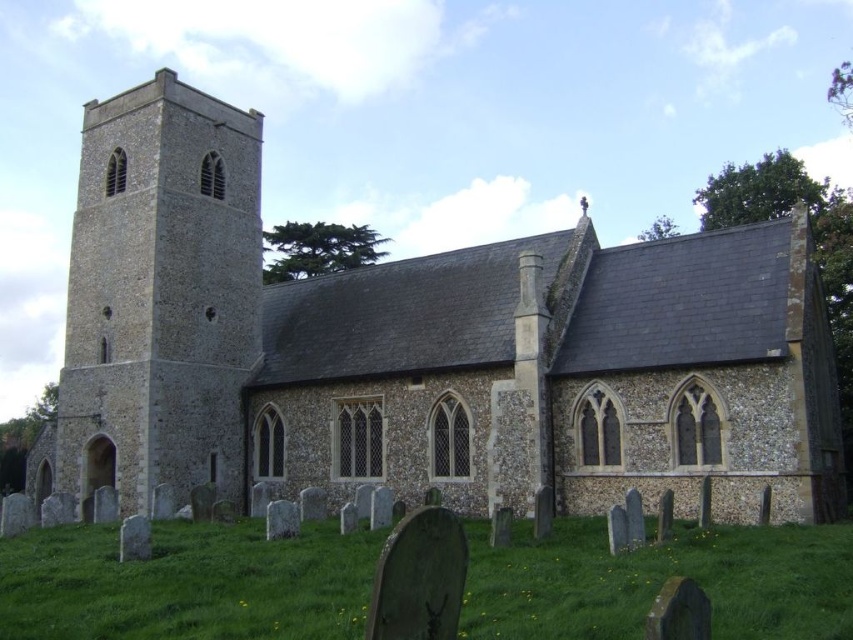
Question: Which object is closer to the camera taking this photo?

Choices:
 (A) stone tower at left
 (B) green grass at lower center
 (C) stone church at center

Answer: (B)

Question: Which point is closer to the camera?

Choices:
 (A) stone tower at left
 (B) stone church at center

Answer: (B)

Question: Can you confirm if stone church at center is positioned above stone tower at left?

Choices:
 (A) yes
 (B) no

Answer: (B)

Question: Does stone church at center have a larger size compared to green grass at lower center?

Choices:
 (A) no
 (B) yes

Answer: (B)

Question: Does stone church at center have a smaller size compared to green grass at lower center?

Choices:
 (A) no
 (B) yes

Answer: (A)

Question: Among these points, which one is farthest from the camera?

Choices:
 (A) (173, 280)
 (B) (337, 278)

Answer: (B)